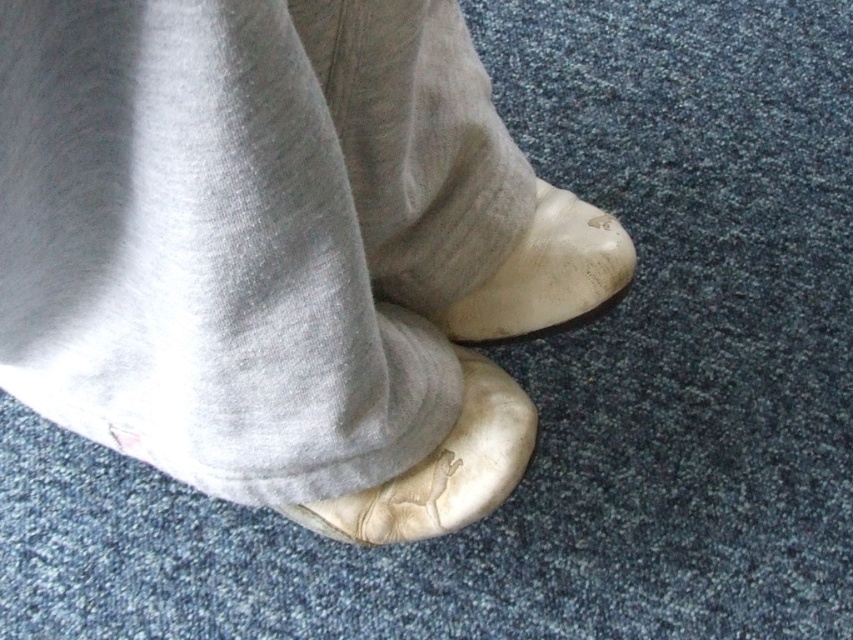
Looking at this image, how far apart are leather shoe at lower center and leather shoe at center?

leather shoe at lower center and leather shoe at center are 5.81 inches apart from each other.

Can you confirm if leather shoe at lower center is shorter than leather shoe at center?

Incorrect, leather shoe at lower center's height does not fall short of leather shoe at center's.

Between point (461, 513) and point (514, 262), which one is positioned behind?

The point (514, 262) is more distant.

Locate an element on the screen. The height and width of the screenshot is (640, 853). leather shoe at lower center is located at coordinates (440, 468).

Is leather slipper at center above leather shoe at lower center?

Yes, leather slipper at center is above leather shoe at lower center.

Does leather slipper at center appear on the left side of leather shoe at lower center?

Indeed, leather slipper at center is positioned on the left side of leather shoe at lower center.

Which is in front, point (433, 112) or point (498, 404)?

Positioned in front is point (433, 112).

Locate an element on the screen. The width and height of the screenshot is (853, 640). leather slipper at center is located at coordinates (281, 252).

Can you confirm if gray cotton sock at center is positioned to the left of leather shoe at center?

Yes, gray cotton sock at center is to the left of leather shoe at center.

From the picture: Can you confirm if gray cotton sock at center is positioned above leather shoe at center?

Indeed, gray cotton sock at center is positioned over leather shoe at center.

At what (x,y) coordinates should I click in order to perform the action: click on gray cotton sock at center. Please return your answer as a coordinate pair (x, y). Image resolution: width=853 pixels, height=640 pixels. Looking at the image, I should click on (416, 144).

I want to click on gray cotton sock at center, so click(416, 144).